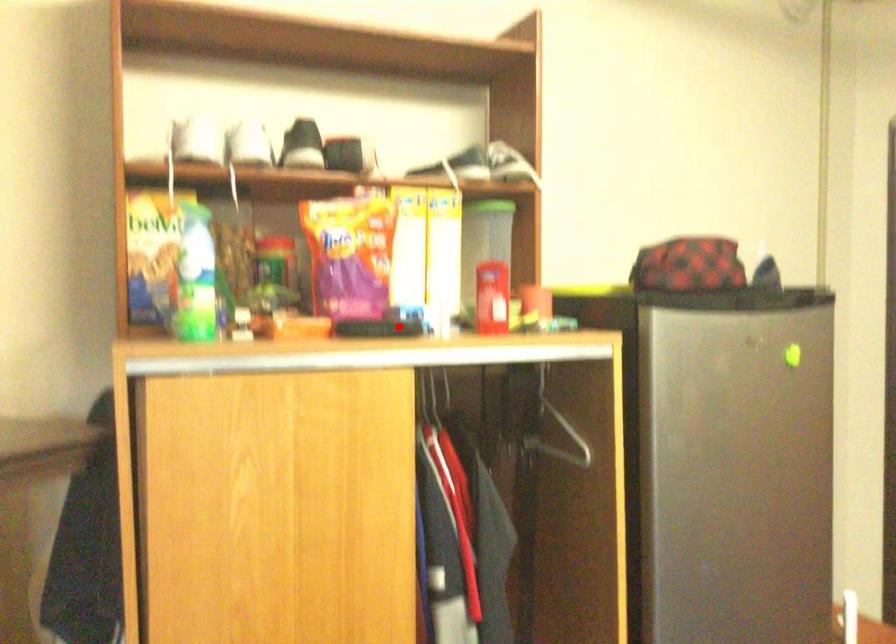
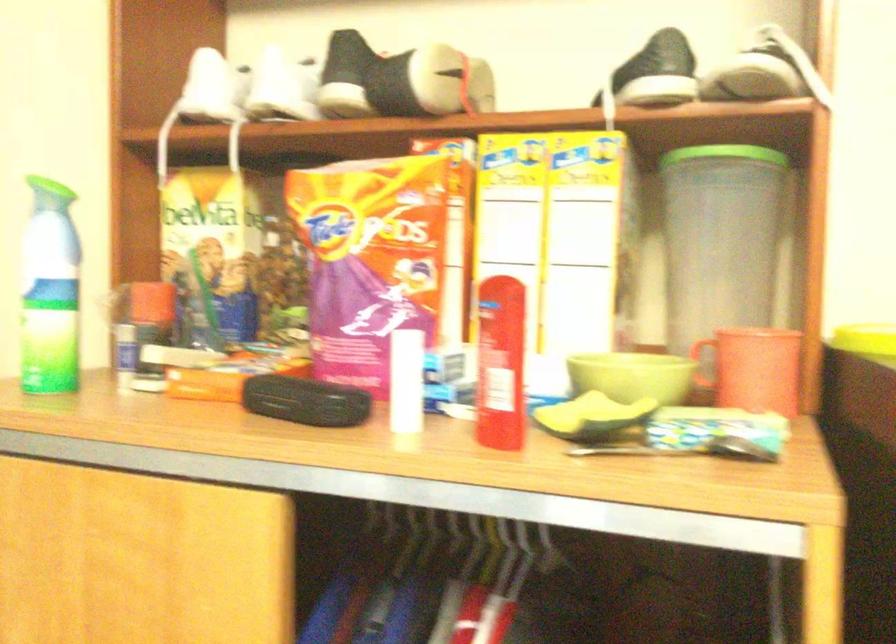
In the second image, find the point that corresponds to the highlighted location in the first image.

(306, 401)